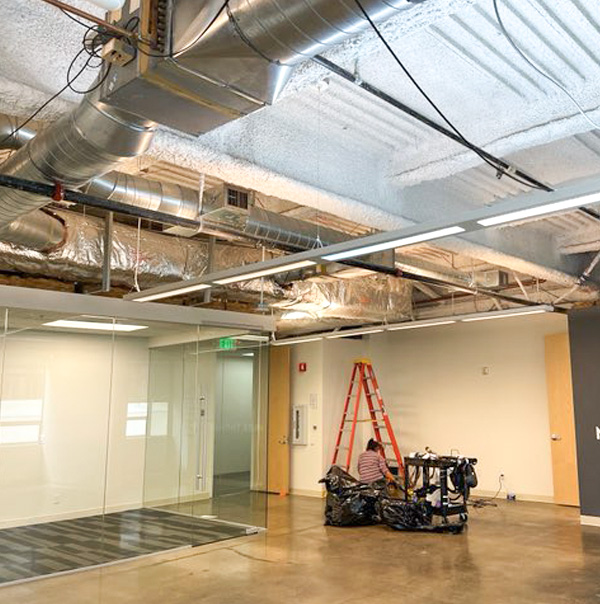
The height and width of the screenshot is (604, 600). I want to click on brown doorknob, so click(x=554, y=434).